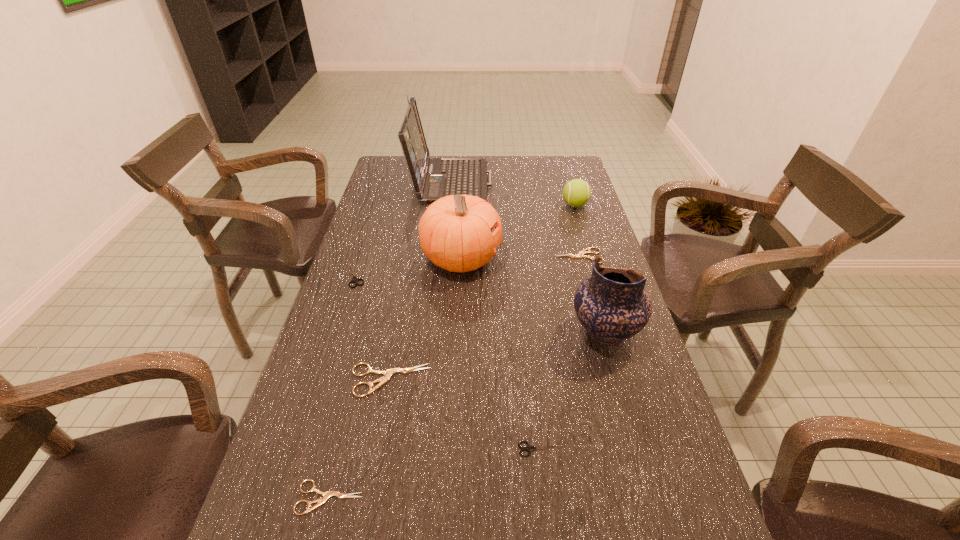
The height and width of the screenshot is (540, 960). I want to click on the rightmost beige shears, so click(581, 254).

The image size is (960, 540). I want to click on the second biggest beige shears, so click(x=581, y=254).

Find the location of a particular element. the smallest beige shears is located at coordinates (326, 495).

The height and width of the screenshot is (540, 960). Find the location of `the nearest object`. the nearest object is located at coordinates (326, 495).

The width and height of the screenshot is (960, 540). Find the location of `the smaller black shears`. the smaller black shears is located at coordinates (528, 448).

This screenshot has height=540, width=960. What are the coordinates of `the right black shears` in the screenshot? It's located at (528, 448).

I want to click on vacant space situated on the front-facing side of the tallest object, so click(529, 179).

Where is `free point located on the front-facing side of the pumpkin`? The height and width of the screenshot is (540, 960). free point located on the front-facing side of the pumpkin is located at coordinates (543, 259).

Where is `free point located 0.150m on the back of the blue pottery`? free point located 0.150m on the back of the blue pottery is located at coordinates (588, 271).

You are a GUI agent. You are given a task and a screenshot of the screen. Output one action in this format:
    pyautogui.click(x=<x>, y=<y>)
    Task: Click on the vacant region located on the left of the tennis ball
    The height and width of the screenshot is (540, 960).
    Given the screenshot: What is the action you would take?
    coord(541,205)